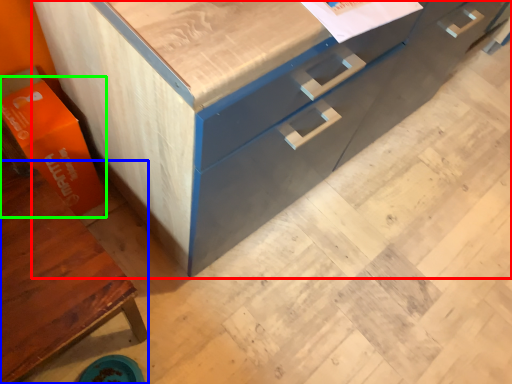
Question: Which is nearer to the chest of drawers (highlighted by a red box)? cabinetry (highlighted by a blue box) or cardboard box (highlighted by a green box).

Choices:
 (A) cabinetry
 (B) cardboard box

Answer: (B)